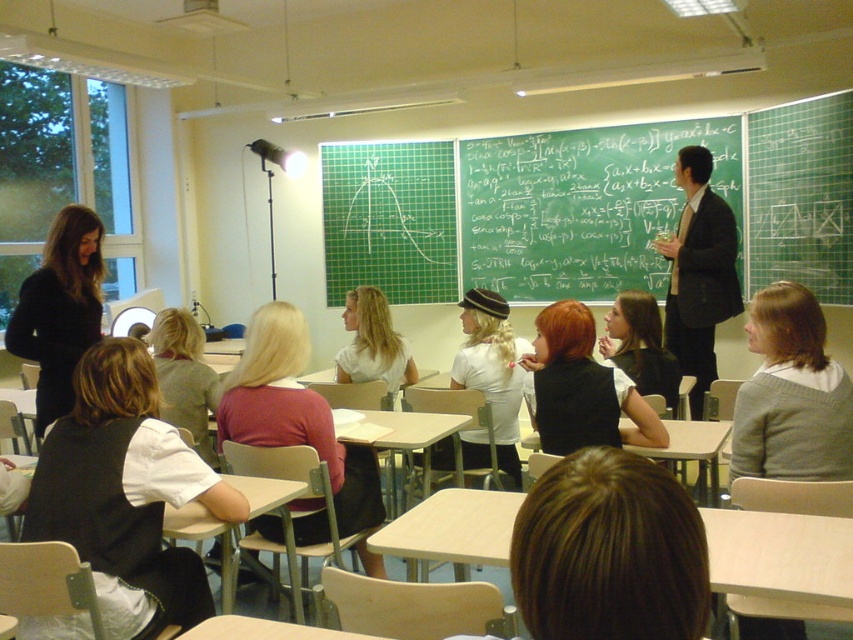
You are a student sitting at the back of the classroom. You need to copy an equation from the green chalkboard at upper center and the black suit at center. Which object is located to the left of the other?

The green chalkboard at upper center is positioned on the left side of black suit at center.

You are a student sitting in the back row of the classroom. You need to copy an equation from the green chalkboard at upper center but notice the black suit at center is blocking your view. Can you still see the entire chalkboard?

The green chalkboard at upper center is larger in size than the black suit at center, so it is possible that parts of the chalkboard remain visible around the black suit at center. However, the exact visibility depends on the positioning and distance between you and the obstruction.